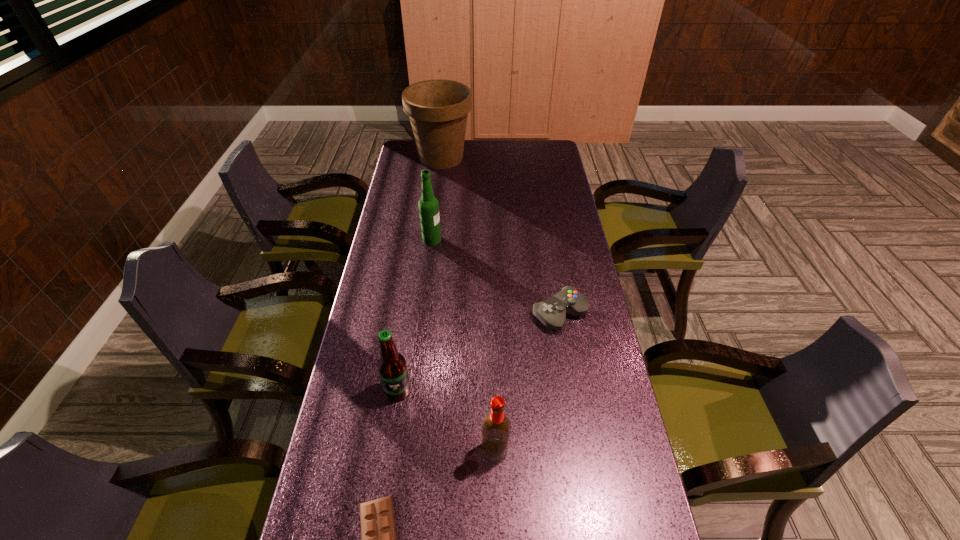
At what (x,y) coordinates should I click in order to perform the action: click on vacant space at the far right corner of the desktop. Please return your answer as a coordinate pair (x, y). The height and width of the screenshot is (540, 960). Looking at the image, I should click on (529, 159).

The image size is (960, 540). Find the location of `empty space between the farthest beer bottle and the second nearest beer bottle`. empty space between the farthest beer bottle and the second nearest beer bottle is located at coordinates (415, 315).

The height and width of the screenshot is (540, 960). What are the coordinates of `free spot between the fifth farthest object and the farthest beer bottle` in the screenshot? It's located at (464, 345).

Where is `vacant point located between the fifth nearest object and the fifth tallest object`? vacant point located between the fifth nearest object and the fifth tallest object is located at coordinates (495, 276).

Identify the location of free space between the flowerpot and the fourth nearest object. (500, 236).

Find the location of a particular element. The image size is (960, 540). unoccupied area between the tallest beer bottle and the control is located at coordinates (495, 276).

You are a GUI agent. You are given a task and a screenshot of the screen. Output one action in this format:
    pyautogui.click(x=<x>, y=<y>)
    Task: Click on the vacant area that lies between the tallest beer bottle and the farthest object
    The height and width of the screenshot is (540, 960).
    Given the screenshot: What is the action you would take?
    pyautogui.click(x=437, y=199)

Choose which object is the second nearest neighbor to the shortest object. Please provide its 2D coordinates. Your answer should be formatted as a tuple, i.e. [(x, y)], where the tuple contains the x and y coordinates of a point satisfying the conditions above.

[(392, 368)]

You are a GUI agent. You are given a task and a screenshot of the screen. Output one action in this format:
    pyautogui.click(x=<x>, y=<y>)
    Task: Click on the object that is the second closest one to the third nearest object
    The image size is (960, 540).
    Given the screenshot: What is the action you would take?
    pyautogui.click(x=378, y=531)

Where is `beer bottle that stands as the second closest to the fifth nearest object`? The image size is (960, 540). beer bottle that stands as the second closest to the fifth nearest object is located at coordinates (496, 427).